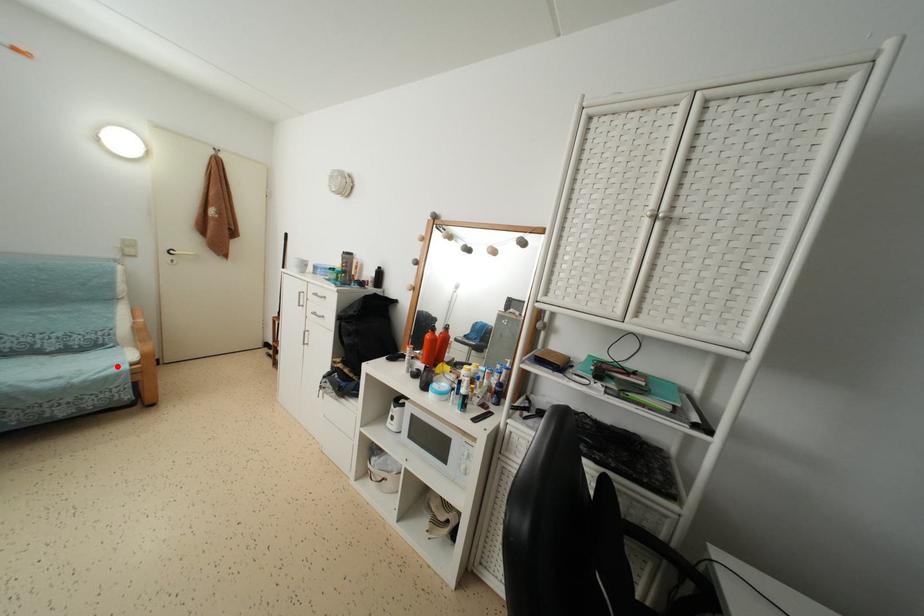
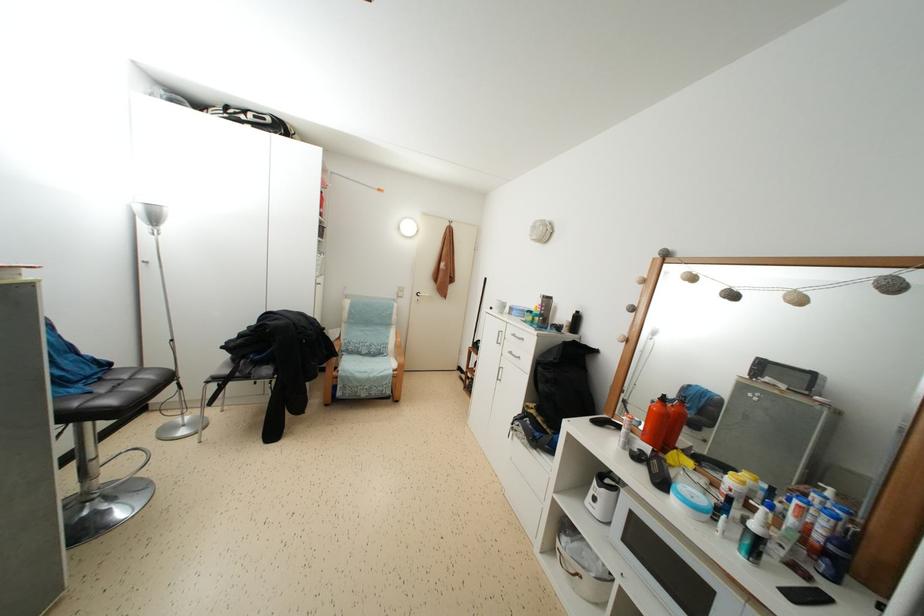
Locate, in the second image, the point that corresponds to the highlighted location in the first image.

(390, 371)